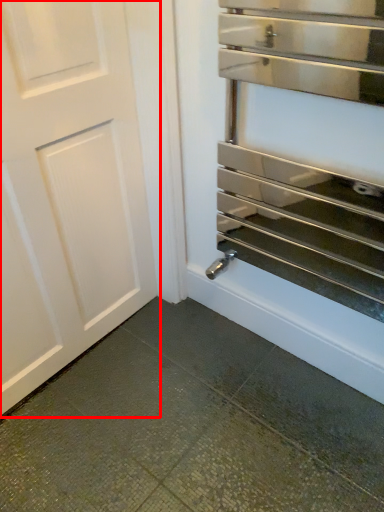
Question: From the image's perspective, what is the correct spatial relationship of door (annotated by the red box) in relation to oven?

Choices:
 (A) above
 (B) below

Answer: (B)